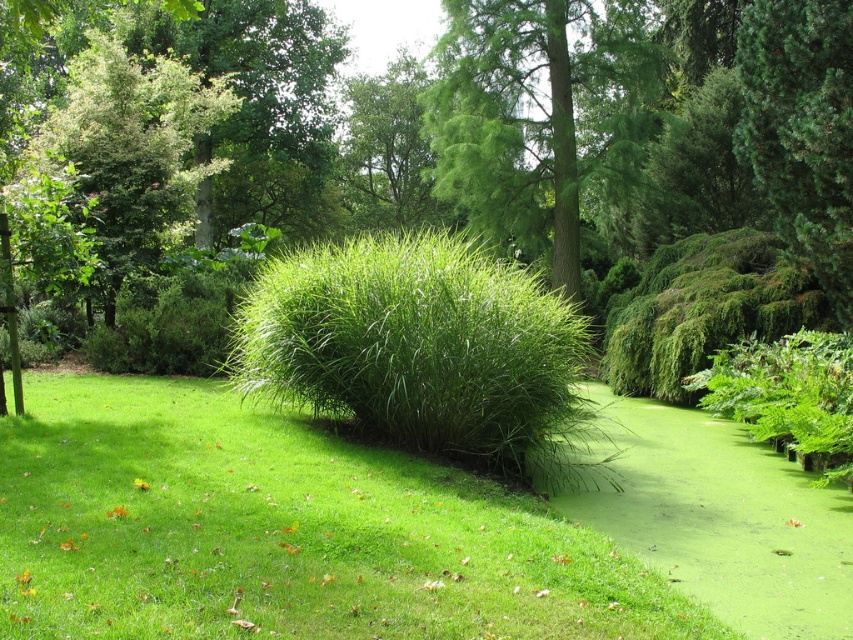
Looking at this image, you are a gardener planning to plant a new flowerbed between the green leafy bush at center and the green leafy tree at upper left. Based on their positions, which direction should you start digging relative to the tree?

The green leafy bush at center is positioned on the right side of the green leafy tree at upper left. Therefore, you should start digging to the right of the green leafy tree at upper left to place the new flowerbed between them.

You are planning to install a small garden bench between the green leafy tree at center and the green leafy tree at upper left. The bench requires a minimum of 10 meters of space between the two trees to be placed comfortably. Based on the distance provided, can the bench be installed in this location?

The green leafy tree at center is 11.78 meters from the green leafy tree at upper left. Since the required minimum distance is 10 meters, the bench can be comfortably installed between them as the available space meets the requirement.

You are a gardener planning to plant a new flower bed between the green leafy bush at center and the green leafy tree at upper left. Based on their heights, which one will cast more shade over the flower bed during the afternoon?

The green leafy tree at upper left is taller than the green leafy bush at center, so it will cast more shade over the flower bed during the afternoon.